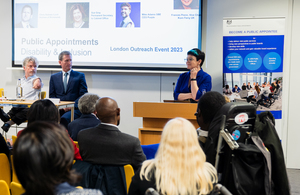
Locate an element on the screen. wooden podium is located at coordinates (146, 111).